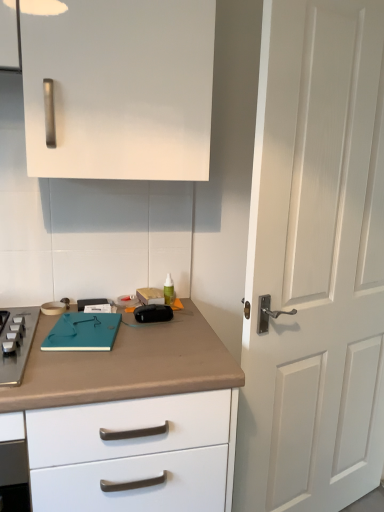
This screenshot has width=384, height=512. What are the coordinates of `vacant space situated above brown matte countertop at lower left (from a real-world perspective)` in the screenshot? It's located at (102, 332).